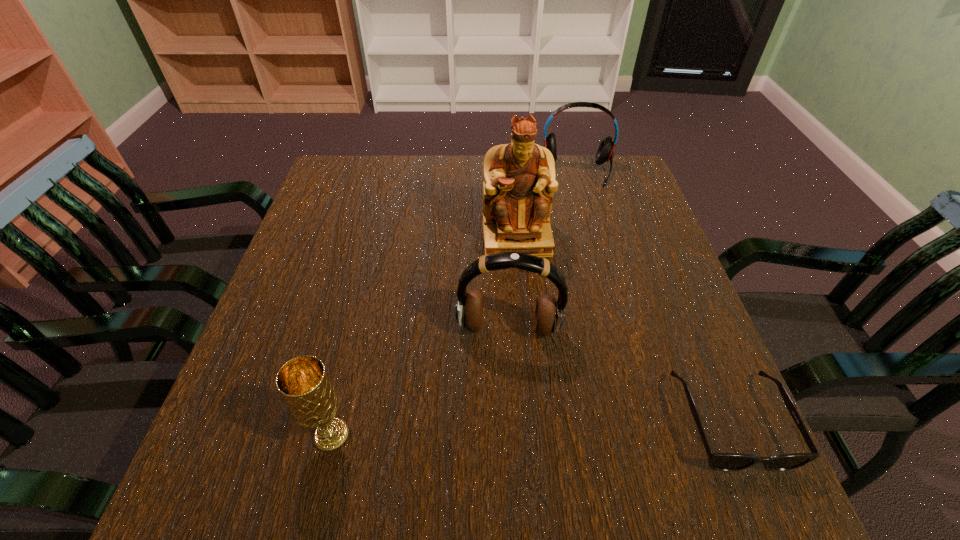
Find the location of a particular element. blank space located with the microphone attached to the side of the right headset is located at coordinates (578, 211).

Image resolution: width=960 pixels, height=540 pixels. In order to click on vacant space located 0.310m with the microphone attached to the side of the right headset in this screenshot , I will do `click(580, 262)`.

I want to click on blank area located on the front-facing side of the figurine, so (521, 276).

Identify the location of blank space located on the front-facing side of the figurine. This screenshot has height=540, width=960. (525, 310).

Where is `vacant region located 0.070m on the front-facing side of the figurine`? The height and width of the screenshot is (540, 960). vacant region located 0.070m on the front-facing side of the figurine is located at coordinates (521, 280).

Image resolution: width=960 pixels, height=540 pixels. What are the coordinates of `free space located 0.100m on the ear cup of the third nearest object` in the screenshot? It's located at (503, 390).

Image resolution: width=960 pixels, height=540 pixels. What are the coordinates of `vacant point located 0.160m on the ear cup of the third nearest object` in the screenshot? It's located at (501, 421).

At what (x,y) coordinates should I click in order to perform the action: click on free space located 0.100m on the ear cup of the third nearest object. Please return your answer as a coordinate pair (x, y). This screenshot has height=540, width=960. Looking at the image, I should click on [503, 390].

Identify the location of object that is at the far edge. (605, 151).

Find the location of a particular element. The height and width of the screenshot is (540, 960). chalice that is at the near edge is located at coordinates (303, 382).